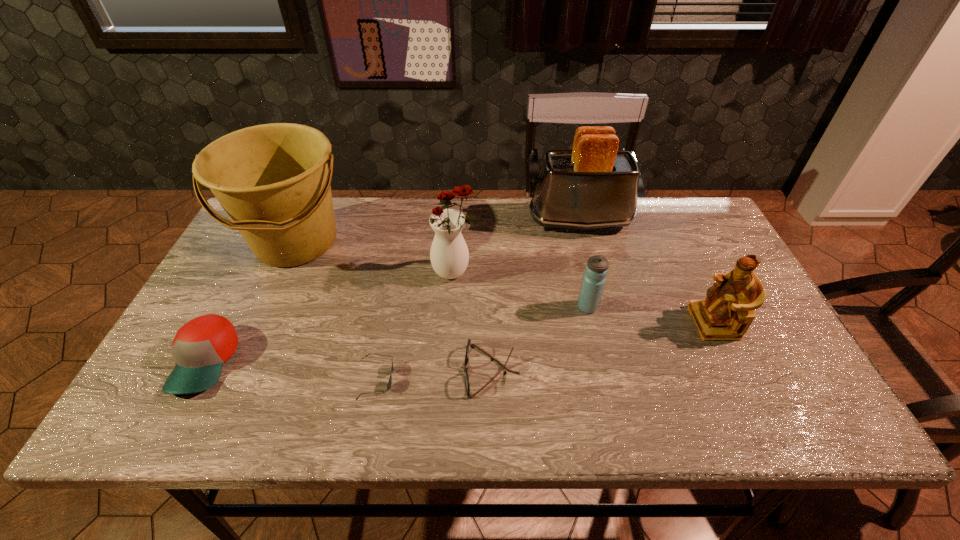
Image resolution: width=960 pixels, height=540 pixels. What are the coordinates of `toaster` in the screenshot? It's located at (594, 186).

Find the location of a particular element. bucket is located at coordinates point(272,180).

This screenshot has width=960, height=540. Identify the location of vase. (449, 255).

What are the coordinates of `figurine` in the screenshot? It's located at (727, 312).

At what (x,y) coordinates should I click in order to perform the action: click on the fifth shortest object. Please return your answer as a coordinate pair (x, y). Looking at the image, I should click on 727,312.

Find the location of a particular element. This screenshot has width=960, height=540. the fifth tallest object is located at coordinates (593, 282).

Identify the location of baseball cap. (200, 347).

Where is `spectacles`? Image resolution: width=960 pixels, height=540 pixels. spectacles is located at coordinates (467, 383).

Where is `the third object from left to right`? This screenshot has height=540, width=960. the third object from left to right is located at coordinates (392, 368).

At what (x,y) coordinates should I click in order to perform the action: click on the shortest object. Please return your answer as a coordinate pair (x, y). Image resolution: width=960 pixels, height=540 pixels. Looking at the image, I should click on (392, 368).